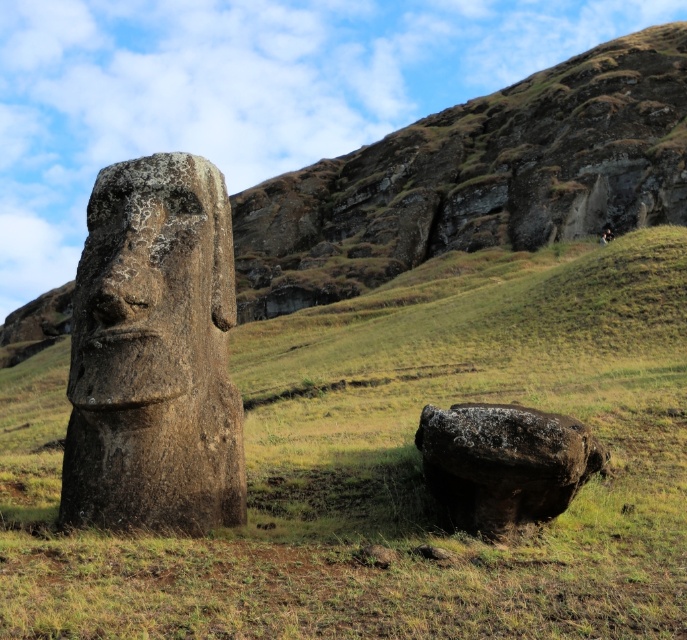
Is green grassy at center behind rusty stone boulder at lower right?

No.

Who is shorter, green grassy at center or rusty stone boulder at lower right?

Standing shorter between the two is rusty stone boulder at lower right.

This screenshot has width=687, height=640. In order to click on green grassy at center in this screenshot , I will do `click(394, 465)`.

Can you confirm if rough stone head at center is thinner than rusty stone boulder at lower right?

Yes.

Who is higher up, rough stone head at center or rusty stone boulder at lower right?

rough stone head at center

What do you see at coordinates (153, 284) in the screenshot? The height and width of the screenshot is (640, 687). I see `rough stone head at center` at bounding box center [153, 284].

The height and width of the screenshot is (640, 687). What are the coordinates of `rough stone head at center` in the screenshot? It's located at tap(153, 284).

Which is behind, point (506, 292) or point (78, 282)?

The point (506, 292) is more distant.

Measure the distance between point [605,605] and camera.

The distance of point [605,605] from camera is 5.19 meters.

The height and width of the screenshot is (640, 687). Find the location of `green grassy at center`. green grassy at center is located at coordinates (394, 465).